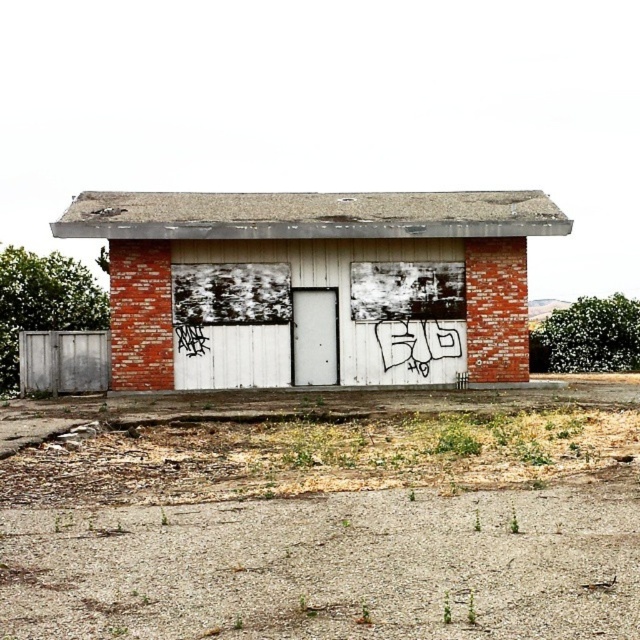
Question: From the image, what is the correct spatial relationship of gray metallic gate at lower left in relation to white matte garage door at center?

Choices:
 (A) right
 (B) left

Answer: (B)

Question: Which point appears closest to the camera in this image?

Choices:
 (A) (339, 248)
 (B) (310, 356)
 (C) (33, 384)

Answer: (A)

Question: Which object appears closest to the camera in this image?

Choices:
 (A) white matte garage door at center
 (B) gray metallic gate at lower left
 (C) brick building at center

Answer: (C)

Question: Which object is closer to the camera taking this photo?

Choices:
 (A) gray metallic gate at lower left
 (B) white matte garage door at center
 (C) brick building at center

Answer: (C)

Question: Is gray metallic gate at lower left positioned behind white matte garage door at center?

Choices:
 (A) yes
 (B) no

Answer: (B)

Question: Can you confirm if brick building at center is positioned to the right of white matte garage door at center?

Choices:
 (A) no
 (B) yes

Answer: (A)